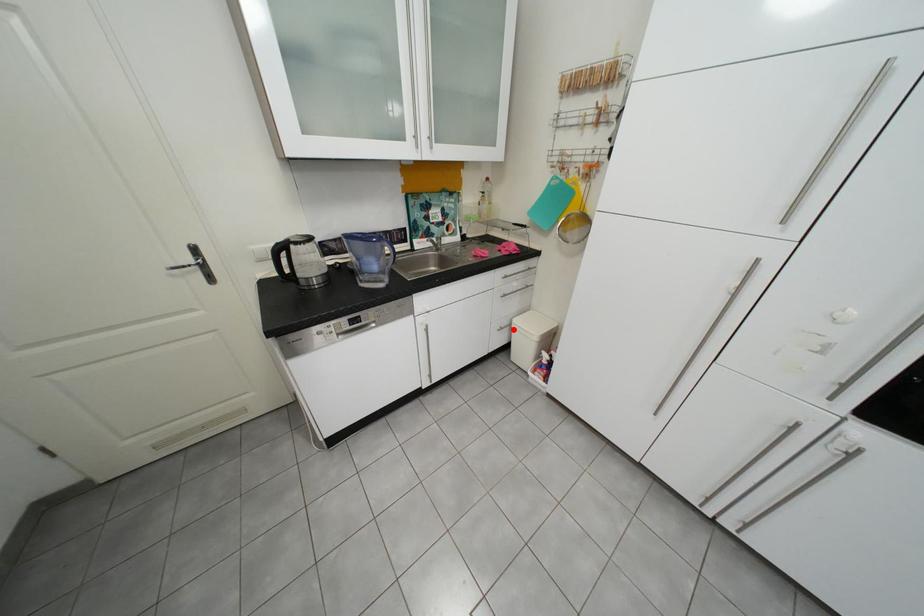
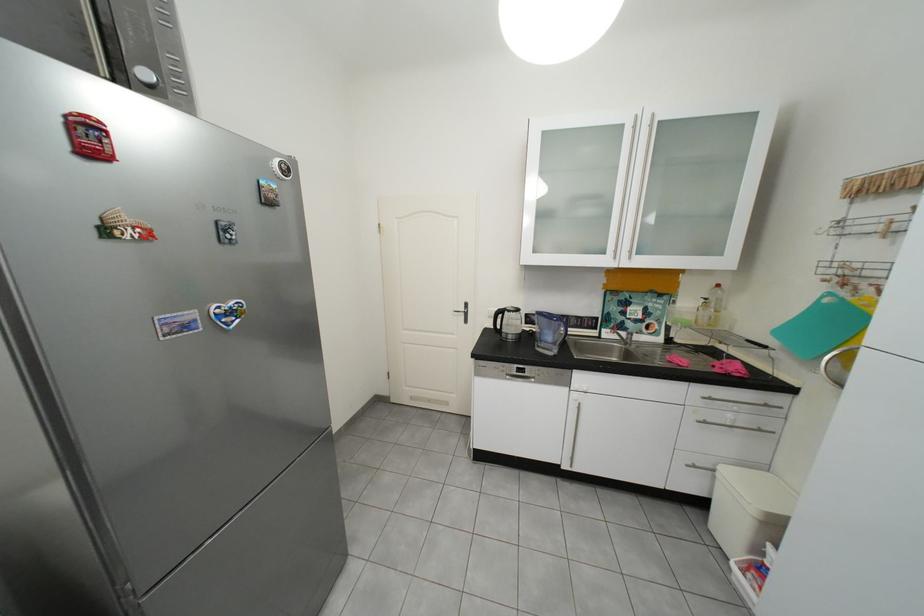
Question: I am providing you with two images of the same scene from different viewpoints. A red point is marked on the first image. Is the red point's position out of view in image 2?

Choices:
 (A) Yes
 (B) No

Answer: (B)